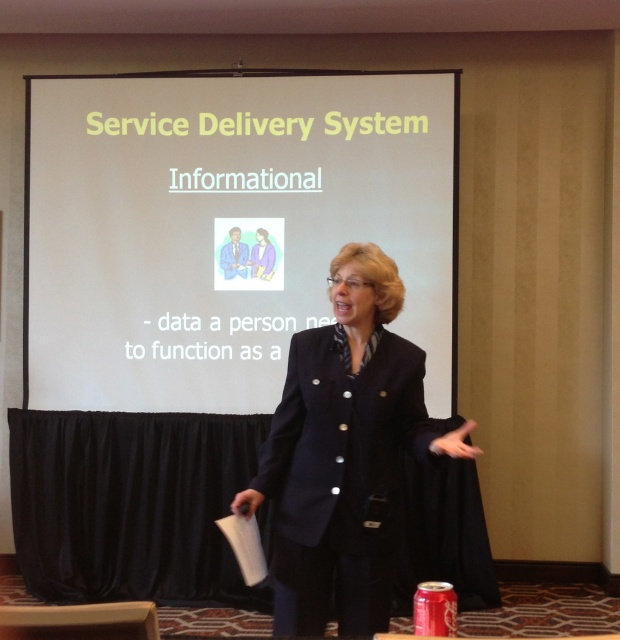
What is the point at position (224, 228) located on?

The point at position (224, 228) is located on the white paper at center.

You are a photographer adjusting your camera to focus on two points in the presentation scene. The first point is at coordinates point (95, 250) and the second is at point (321, 492). Which point should you focus on first if you want to capture the closest object to the camera?

Point (95, 250) is further to the camera than point (321, 492), so you should focus on point (95, 250) first as it is closer to the camera.